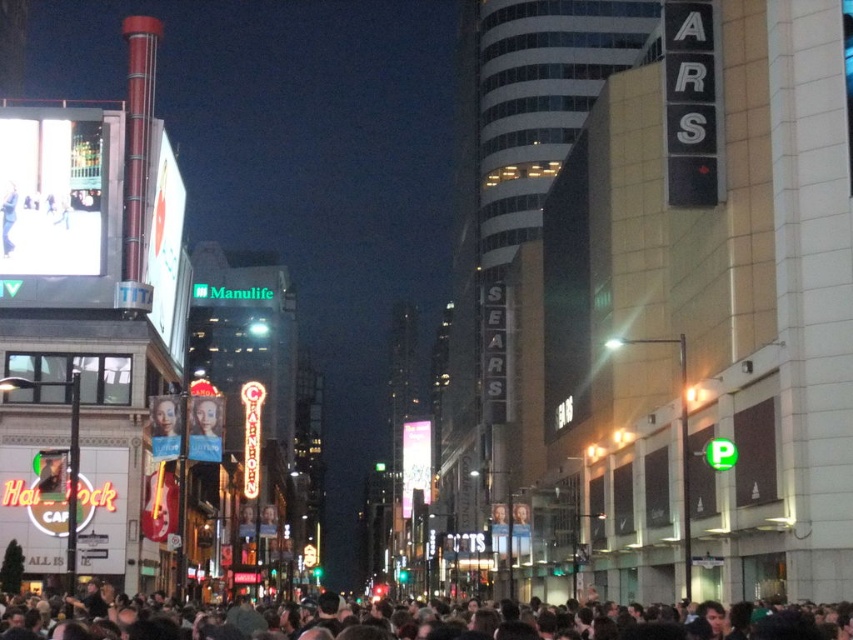
Does dark brown hair at lower center appear over smooth skin face at center?

Actually, dark brown hair at lower center is below smooth skin face at center.

Image resolution: width=853 pixels, height=640 pixels. What do you see at coordinates (438, 621) in the screenshot? I see `dark brown hair at lower center` at bounding box center [438, 621].

Does point (489, 618) lie in front of point (157, 413)?

Yes, point (489, 618) is in front of point (157, 413).

Locate an element on the screen. Image resolution: width=853 pixels, height=640 pixels. dark brown hair at lower center is located at coordinates (438, 621).